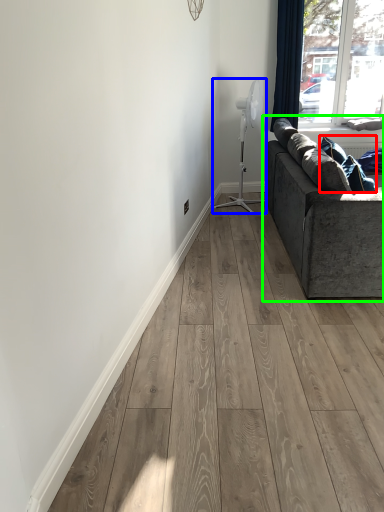
Question: Estimate the real-world distances between objects in this image. Which object is closer to pillow (highlighted by a red box), fan (highlighted by a blue box) or studio couch (highlighted by a green box)?

Choices:
 (A) fan
 (B) studio couch

Answer: (B)